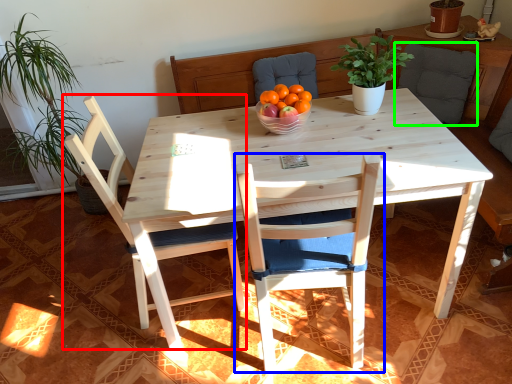
Question: Estimate the real-world distances between objects in this image. Which object is closer to chair (highlighted by a red box), chair (highlighted by a blue box) or armchair (highlighted by a green box)?

Choices:
 (A) chair
 (B) armchair

Answer: (A)